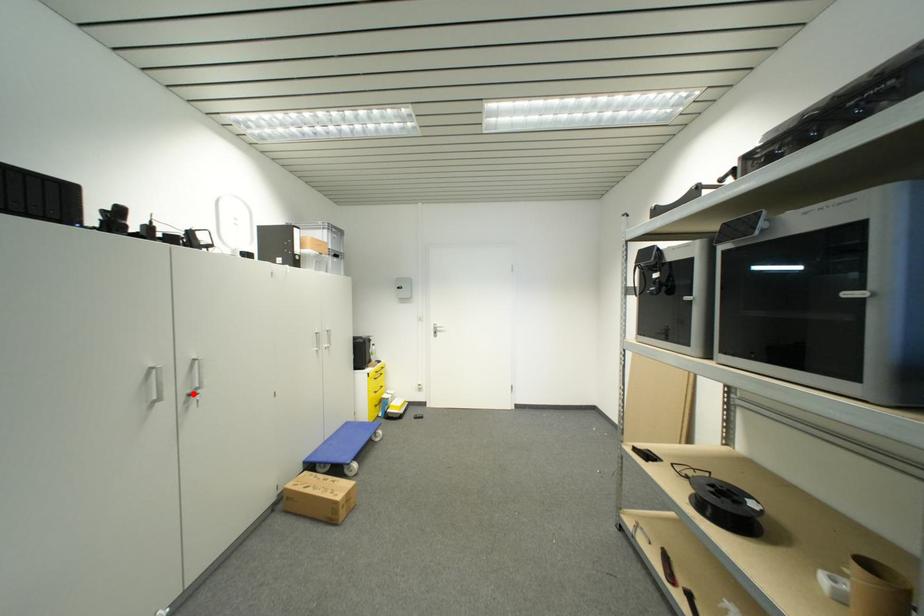
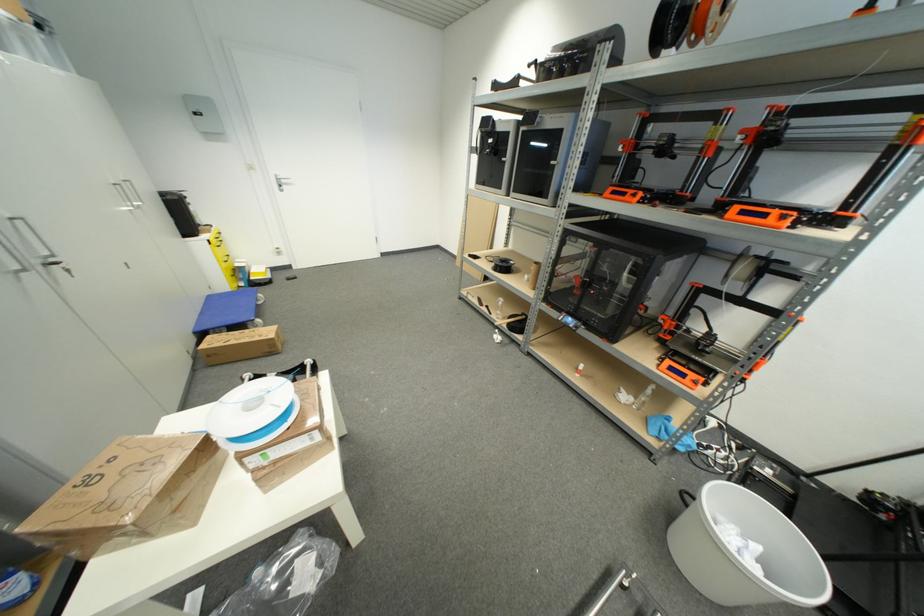
In the second image, find the point that corresponds to the highlighted location in the first image.

(43, 264)